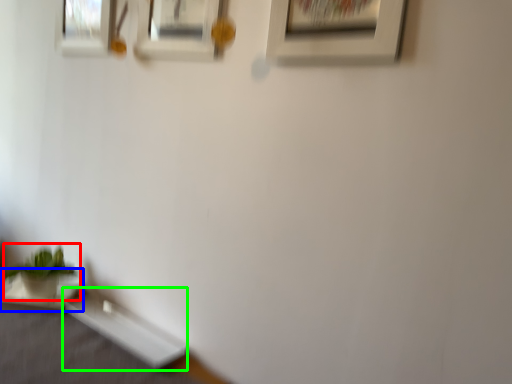
Question: Which is nearer to the houseplant (highlighted by a red box)? table (highlighted by a blue box) or table (highlighted by a green box).

Choices:
 (A) table
 (B) table

Answer: (A)